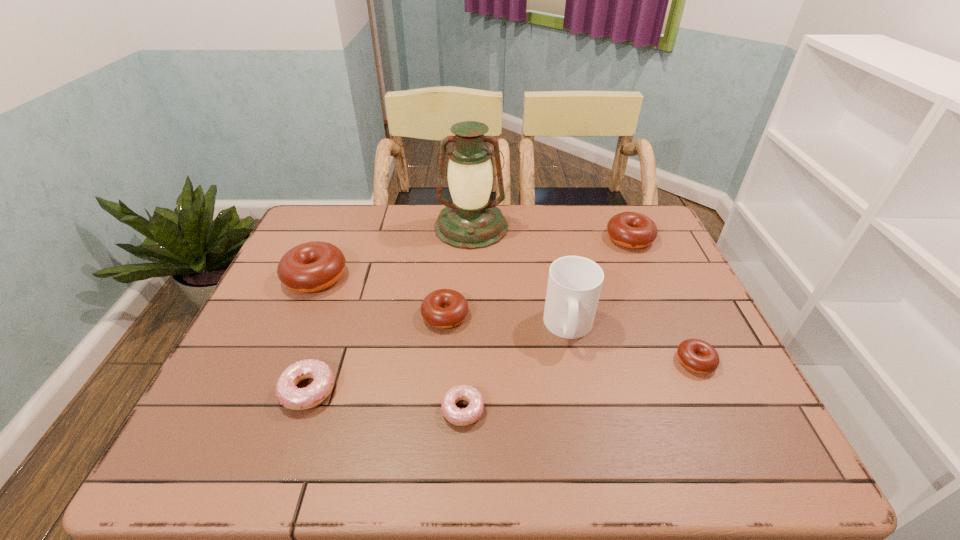
Choose which doughnut is the third nearest neighbor to the biggest chocolate doughnut. Please provide its 2D coordinates. Your answer should be formatted as a tuple, i.e. [(x, y)], where the tuple contains the x and y coordinates of a point satisfying the conditions above.

[(469, 415)]

Select which chocolate doughnut appears as the closest to the smaller pink doughnut. Please provide its 2D coordinates. Your answer should be formatted as a tuple, i.e. [(x, y)], where the tuple contains the x and y coordinates of a point satisfying the conditions above.

[(444, 308)]

Where is `chocolate doughnut that can be found as the second closest to the tallest doughnut`? chocolate doughnut that can be found as the second closest to the tallest doughnut is located at coordinates (634, 230).

Where is `vacant space that satisfies the following two spatial constraints: 1. with the light compartment facing forward on the lantern; 2. on the left side of the nearest chocolate doughnut`? The height and width of the screenshot is (540, 960). vacant space that satisfies the following two spatial constraints: 1. with the light compartment facing forward on the lantern; 2. on the left side of the nearest chocolate doughnut is located at coordinates (468, 361).

Find the location of a particular element. free space that satisfies the following two spatial constraints: 1. on the front side of the farthest chocolate doughnut; 2. on the left side of the smallest chocolate doughnut is located at coordinates (683, 361).

Find the location of a particular element. This screenshot has height=540, width=960. vacant space that satisfies the following two spatial constraints: 1. on the back side of the second nearest chocolate doughnut; 2. on the left side of the third smallest chocolate doughnut is located at coordinates (451, 238).

Locate an element on the screen. The image size is (960, 540). vacant region that satisfies the following two spatial constraints: 1. on the handle side of the smallest chocolate doughnut; 2. on the left side of the white mug is located at coordinates (576, 361).

Locate an element on the screen. The width and height of the screenshot is (960, 540). blank area in the image that satisfies the following two spatial constraints: 1. with the light compartment facing forward on the tallest object; 2. on the right side of the fourth tallest object is located at coordinates (470, 238).